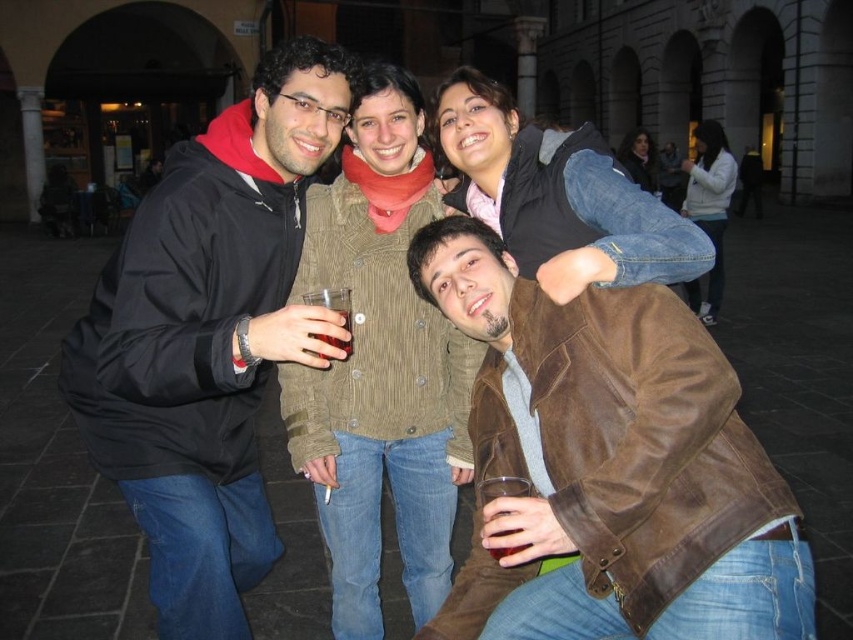
Question: Can you confirm if brown suede jacket at lower right is bigger than black jacket at left?

Choices:
 (A) yes
 (B) no

Answer: (B)

Question: Does brown suede jacket at lower right have a greater width compared to black jacket at left?

Choices:
 (A) yes
 (B) no

Answer: (B)

Question: Which of the following is the closest to the observer?

Choices:
 (A) translucent glass at center
 (B) brown suede jacket at lower right
 (C) black jacket at left

Answer: (B)

Question: From the image, what is the correct spatial relationship of brown suede jacket at lower right in relation to translucent glass at center?

Choices:
 (A) below
 (B) above

Answer: (A)

Question: Which point is closer to the camera?

Choices:
 (A) translucent glass at center
 (B) brown suede jacket at lower right

Answer: (B)

Question: Which point is closer to the camera?

Choices:
 (A) (329, 307)
 (B) (184, 243)
 (C) (608, 579)

Answer: (C)